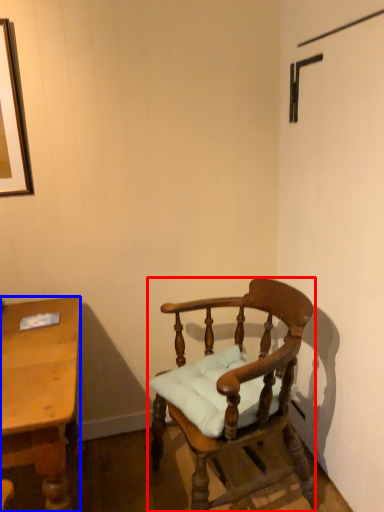
Question: Which object is further to the camera taking this photo, chair (highlighted by a red box) or desk (highlighted by a blue box)?

Choices:
 (A) chair
 (B) desk

Answer: (A)